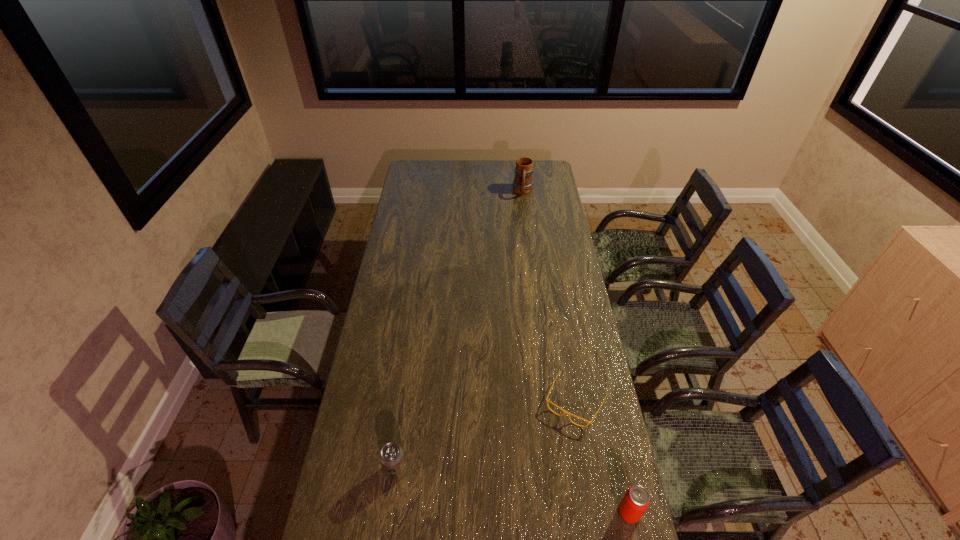
Locate an element on the screen. This screenshot has width=960, height=540. free spot between the farther beer can and the second farthest object is located at coordinates (486, 436).

Identify the location of vacant space in between the nearer beer can and the spectacles. The image size is (960, 540). (602, 457).

The height and width of the screenshot is (540, 960). Find the location of `free space between the spectacles and the leftmost object`. free space between the spectacles and the leftmost object is located at coordinates (486, 436).

At what (x,y) coordinates should I click in order to perform the action: click on vacant area that lies between the spectacles and the tallest object. Please return your answer as a coordinate pair (x, y). This screenshot has height=540, width=960. Looking at the image, I should click on (549, 297).

Find the location of a particular element. This screenshot has width=960, height=540. vacant space that is in between the shortest object and the farther beer can is located at coordinates (486, 436).

The width and height of the screenshot is (960, 540). I want to click on free space between the mug and the right beer can, so click(x=576, y=352).

Identify the location of the second closest object to the spectacles. (391, 456).

Find the location of a particular element. the third closest object to the left beer can is located at coordinates (522, 184).

I want to click on blank area in the image that satisfies the following two spatial constraints: 1. on the back side of the tallest object; 2. on the right side of the leftmost object, so click(434, 192).

Where is `free space that satisfies the following two spatial constraints: 1. on the front side of the second farthest object; 2. on the right side of the tallest object`? Image resolution: width=960 pixels, height=540 pixels. free space that satisfies the following two spatial constraints: 1. on the front side of the second farthest object; 2. on the right side of the tallest object is located at coordinates (549, 402).